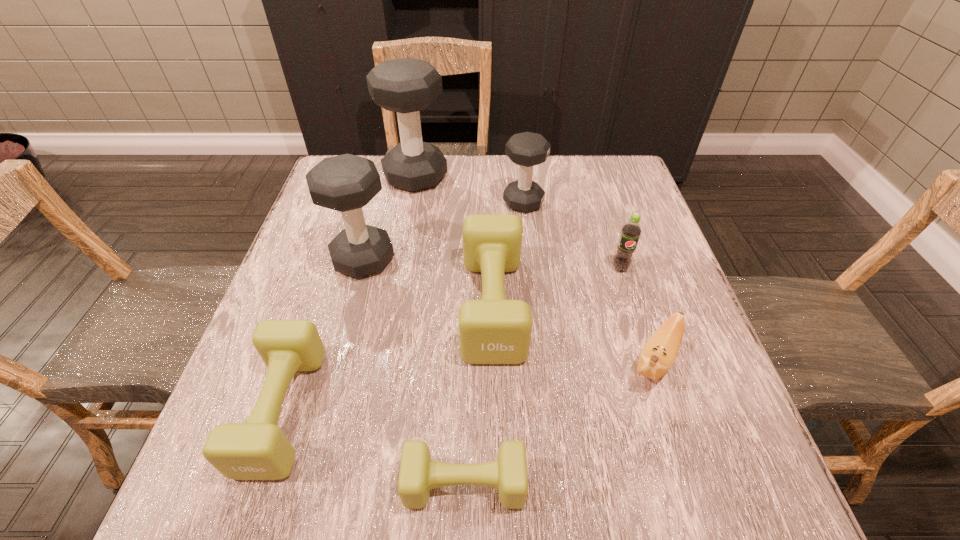
The width and height of the screenshot is (960, 540). In order to click on free space located 0.120m on the front of the yellow banana in this screenshot , I will do `click(689, 463)`.

You are a GUI agent. You are given a task and a screenshot of the screen. Output one action in this format:
    pyautogui.click(x=<x>, y=<y>)
    Task: Click on the free space located 0.140m on the back of the second smallest olive dumbbell
    This screenshot has width=960, height=540.
    Given the screenshot: What is the action you would take?
    pyautogui.click(x=321, y=296)

You are a GUI agent. You are given a task and a screenshot of the screen. Output one action in this format:
    pyautogui.click(x=<x>, y=<y>)
    Task: Click on the vacant space located on the back of the shortest object
    The image size is (960, 540).
    Given the screenshot: What is the action you would take?
    pyautogui.click(x=468, y=321)

Image resolution: width=960 pixels, height=540 pixels. What are the coordinates of `soda that is at the right edge` in the screenshot? It's located at (631, 231).

The width and height of the screenshot is (960, 540). Find the location of `banana that is at the right edge`. banana that is at the right edge is located at coordinates (658, 355).

Where is `object present at the near left corner`? The height and width of the screenshot is (540, 960). object present at the near left corner is located at coordinates (258, 449).

In the image, there is a desktop. Where is `free space at the far edge`? This screenshot has width=960, height=540. free space at the far edge is located at coordinates (453, 179).

In the image, there is a desktop. What are the coordinates of `blank space at the near edge` in the screenshot? It's located at (612, 498).

You are a GUI agent. You are given a task and a screenshot of the screen. Output one action in this format:
    pyautogui.click(x=<x>, y=<y>)
    Task: Click on the free space at the left edge of the desktop
    The height and width of the screenshot is (540, 960).
    Given the screenshot: What is the action you would take?
    pyautogui.click(x=263, y=320)

This screenshot has height=540, width=960. Identify the location of vacant space at the right edge of the desktop. [x=637, y=259].